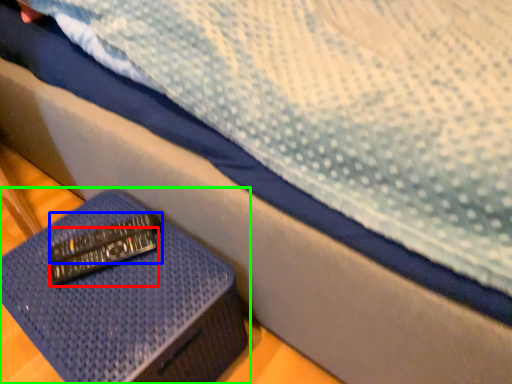
Question: Considering the real-world distances, which object is closest to remote (highlighted by a red box)? remote (highlighted by a blue box) or furniture (highlighted by a green box).

Choices:
 (A) remote
 (B) furniture

Answer: (A)